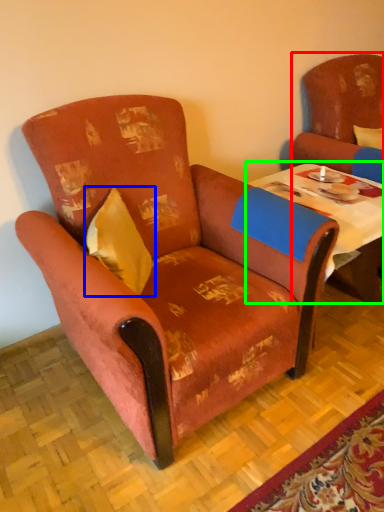
Question: Based on their relative distances, which object is farther from chair (highlighted by a red box)? Choose from pillow (highlighted by a blue box) and table (highlighted by a green box).

Choices:
 (A) pillow
 (B) table

Answer: (A)